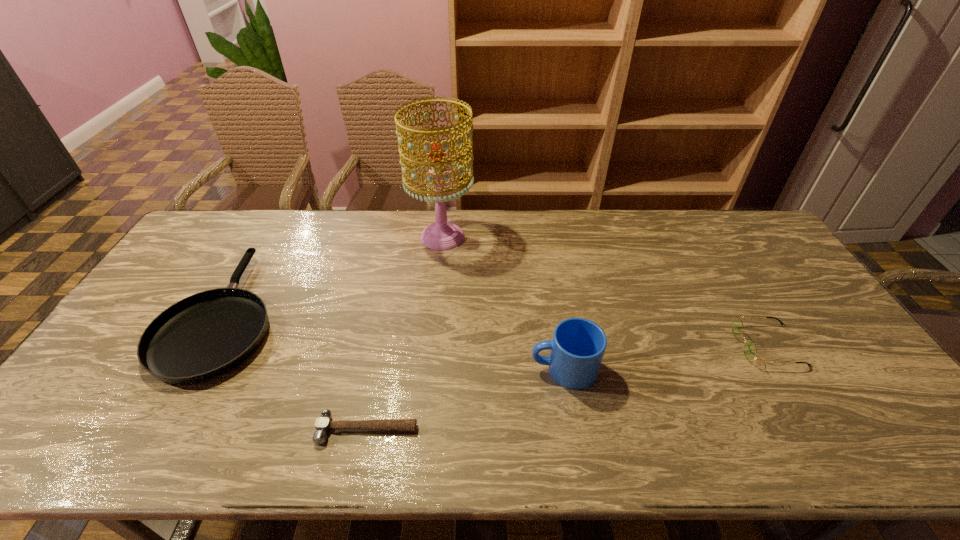
Where is `blank area located on the side of the fourth shortest object with the handle`? This screenshot has width=960, height=540. blank area located on the side of the fourth shortest object with the handle is located at coordinates (442, 369).

At what (x,y) coordinates should I click in order to perform the action: click on vacant space located 0.300m on the lenses of the spectacles. Please return your answer as a coordinate pair (x, y). This screenshot has height=540, width=960. Looking at the image, I should click on (628, 345).

Where is `vacant area located on the lenses of the spectacles`? The image size is (960, 540). vacant area located on the lenses of the spectacles is located at coordinates (690, 345).

Where is `vacant region located on the lenses of the spectacles`? This screenshot has height=540, width=960. vacant region located on the lenses of the spectacles is located at coordinates (693, 345).

I want to click on vacant space located 0.240m on the handle side of the leftmost object, so click(280, 216).

Locate an element on the screen. free space located on the handle side of the leftmost object is located at coordinates (263, 246).

I want to click on vacant space located 0.230m on the handle side of the leftmost object, so click(x=279, y=218).

What are the coordinates of `object that is at the far edge` in the screenshot? It's located at 442,235.

This screenshot has width=960, height=540. What are the coordinates of `object that is positioned at the near edge` in the screenshot? It's located at (323, 424).

This screenshot has width=960, height=540. What are the coordinates of `object located in the left edge section of the desktop` in the screenshot? It's located at (203, 336).